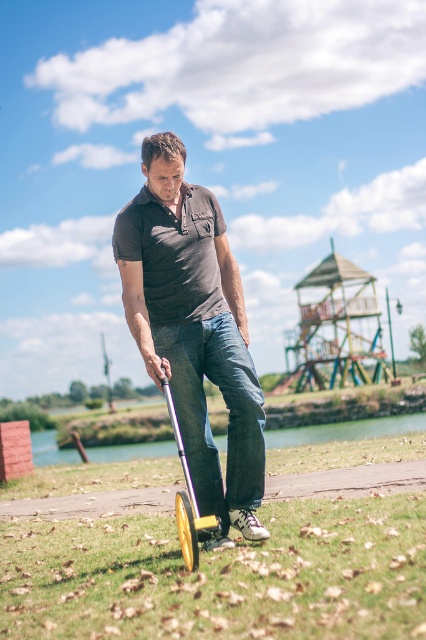
Question: Is matte black shirt at center closer to the viewer compared to yellow rubber scooter at lower center?

Choices:
 (A) yes
 (B) no

Answer: (B)

Question: Which of the following is the farthest from the observer?

Choices:
 (A) (135, 262)
 (B) (178, 528)

Answer: (B)

Question: Which object is positioned farthest from the green grass at lower center?

Choices:
 (A) matte black shirt at center
 (B) yellow rubber scooter at lower center

Answer: (B)

Question: Can you confirm if green grass at lower center is positioned to the right of yellow rubber scooter at lower center?

Choices:
 (A) yes
 (B) no

Answer: (A)

Question: Which point is closer to the camera?

Choices:
 (A) (178, 433)
 (B) (60, 584)

Answer: (A)

Question: Does green grass at lower center have a greater width compared to yellow rubber scooter at lower center?

Choices:
 (A) no
 (B) yes

Answer: (B)